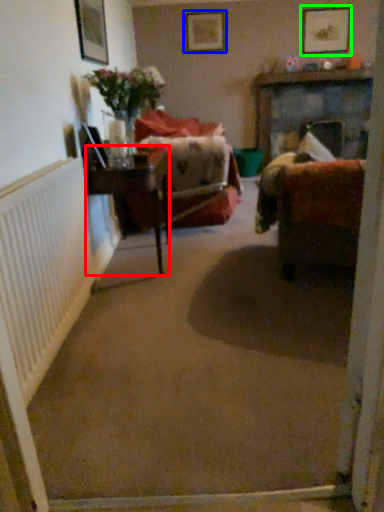
Question: Which object is the closest to the table (highlighted by a red box)? Choose among these: picture frame (highlighted by a blue box) or picture frame (highlighted by a green box).

Choices:
 (A) picture frame
 (B) picture frame

Answer: (A)